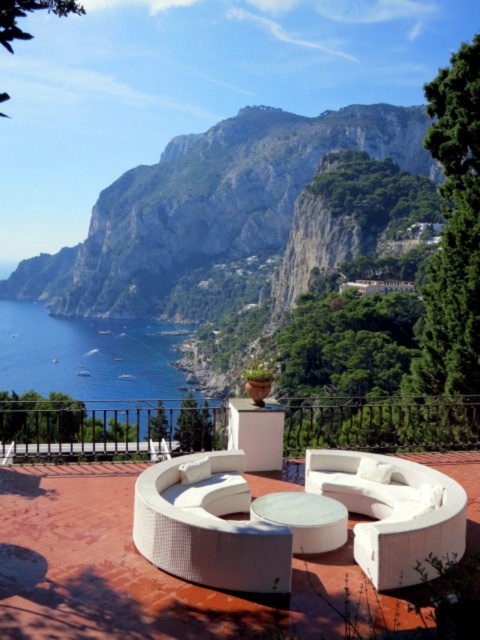
You are standing on the terrace looking out to the Mediterranean Sea. There is a curved white sofa set on a terracotta floor near a low white wall with a metal railing. You see a point marked at coordinates (86, 355). Based on the scene description, can you determine if this point is located on the blue water at lower left or on the terracotta floor near the sofa set?

The point at coordinates (86, 355) is on blue water at lower left, as stated in the objects description.